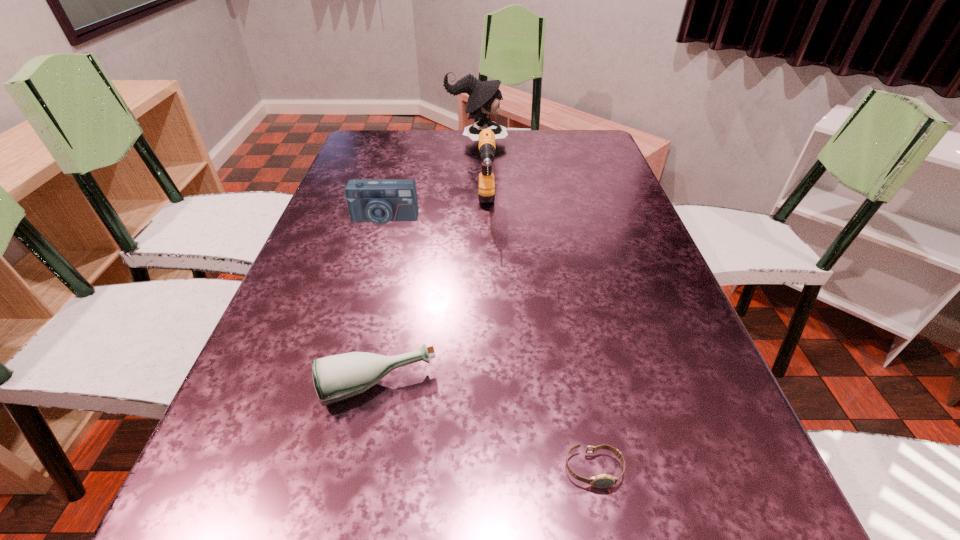
Locate an element on the screen. This screenshot has width=960, height=540. the tallest object is located at coordinates (484, 99).

Identify the location of doll. (484, 99).

Identify the location of drill. pyautogui.click(x=486, y=186).

The image size is (960, 540). Find the location of `camera`. camera is located at coordinates pyautogui.click(x=379, y=201).

The width and height of the screenshot is (960, 540). I want to click on the fourth farthest object, so click(x=338, y=377).

Find the location of a particular element. The image size is (960, 540). bottle is located at coordinates (338, 377).

In order to click on the shortest object in this screenshot , I will do `click(603, 480)`.

The width and height of the screenshot is (960, 540). Find the location of `watch`. watch is located at coordinates (603, 480).

In order to click on free region located 0.070m at the face of the tallest object in this screenshot , I will do `click(528, 141)`.

Locate an element on the screen. Image resolution: width=960 pixels, height=540 pixels. vacant space located 0.370m at the tip of the drill is located at coordinates (490, 347).